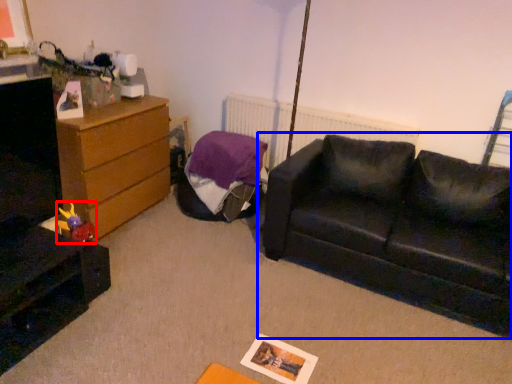
Question: Among these objects, which one is nearest to the camera, toy (highlighted by a red box) or studio couch (highlighted by a blue box)?

Choices:
 (A) toy
 (B) studio couch

Answer: (B)